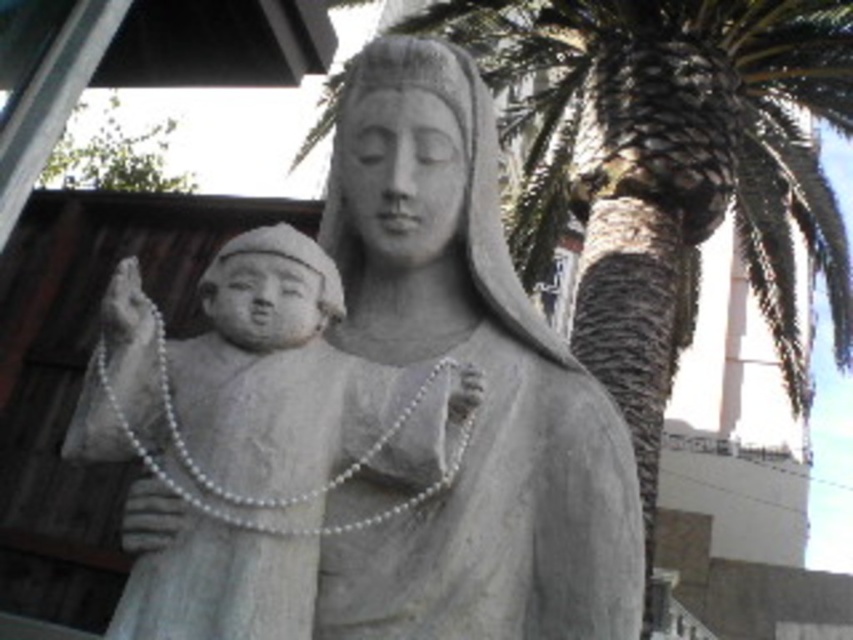
Does gray stone statue at center have a smaller size compared to white stone child at center?

Incorrect, gray stone statue at center is not smaller in size than white stone child at center.

Locate an element on the screen. This screenshot has height=640, width=853. gray stone statue at center is located at coordinates (485, 376).

The width and height of the screenshot is (853, 640). What do you see at coordinates (485, 376) in the screenshot? I see `gray stone statue at center` at bounding box center [485, 376].

Can you confirm if gray stone statue at center is positioned to the right of green leafy palm at upper right?

No, gray stone statue at center is not to the right of green leafy palm at upper right.

I want to click on gray stone statue at center, so click(x=485, y=376).

Is green leafy palm at upper right thinner than white stone child at center?

No, green leafy palm at upper right is not thinner than white stone child at center.

Is point (514, 90) closer to viewer compared to point (442, 401)?

No, it is behind (442, 401).

Who is more distant from viewer, (701, 90) or (190, 428)?

The point (701, 90) is behind.

Find the location of `green leafy palm at upper right`. green leafy palm at upper right is located at coordinates (666, 168).